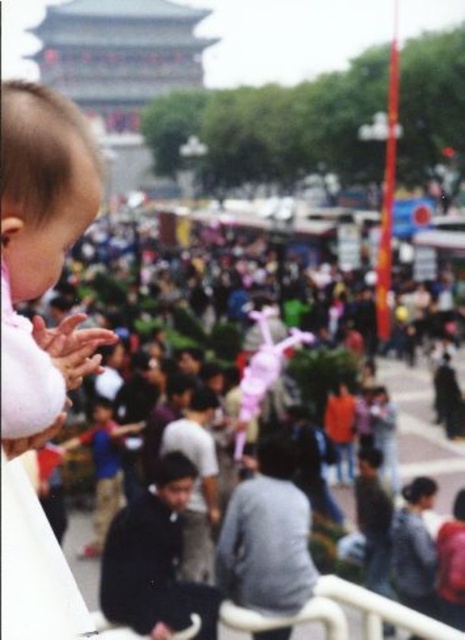
You are a photographer trying to capture the soft pink fabric at left in your shot. Based on its position, where should you aim your camera?

The soft pink fabric at left is located at point 0.292 on the x axis and 0.092 on the y axis, so you should aim your camera at those coordinates to capture it.

You are a photographer trying to capture a detailed shot of the soft pink fabric at left and the purple fabric toy at center. Which object would require a closer focus to ensure clarity?

The soft pink fabric at left requires closer focus because it is thinner than the purple fabric toy at center, making it harder to capture details from a distance.